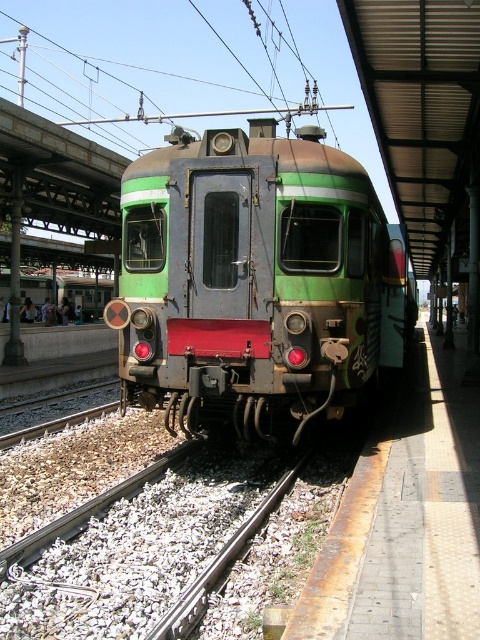
You are a maintenance worker needing to walk from the rusty metal train at center to the gray gravel track at lower left. The path between them is 4.26 meters. If your ladder is 3 meters long, can you safely carry it horizontally without it touching the ground?

The distance between the rusty metal train at center and the gray gravel track at lower left is 4.26 meters. Since the ladder is only 3 meters long, you can safely carry it horizontally as the ladder length is shorter than the distance between the two objects.

You are standing at the train station platform and want to reach a specific point marked at coordinates point (250, 339). If your walking distance limit is 25 feet, will you be able to reach it?

The distance of point (250, 339) from viewer is 23.39 feet, which is within your 25 feet walking limit. Therefore, you can reach it.

You are standing on the platform and want to walk to the end of the tracks. Which direction should you go relative to the rusty metal train at center to follow the gray gravel track at lower left?

The gray gravel track at lower left is behind the rusty metal train at center, so you should walk behind the rusty metal train at center to follow the gray gravel track at lower left towards the end of the tracks.